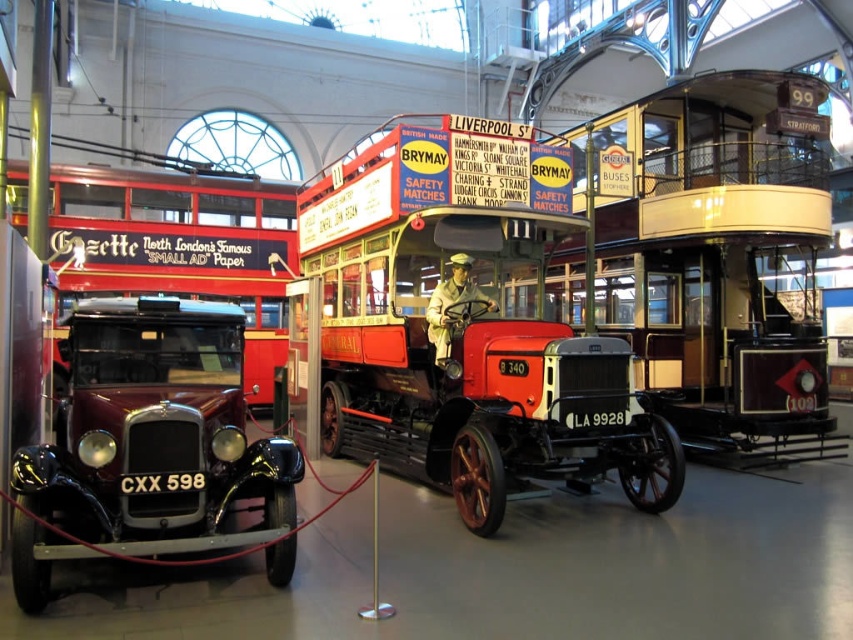
Who is positioned more to the left, matte black bus at center or red polished wood double-decker bus at left?

From the viewer's perspective, red polished wood double-decker bus at left appears more on the left side.

In the scene shown: Which of these two, matte black bus at center or red polished wood double-decker bus at left, stands taller?

Standing taller between the two is red polished wood double-decker bus at left.

The width and height of the screenshot is (853, 640). In order to click on matte black bus at center in this screenshot , I will do `click(712, 259)`.

In order to click on matte black bus at center in this screenshot , I will do `click(712, 259)`.

Can you confirm if red polished wood bus at center is positioned to the right of matte black bus at center?

Incorrect, red polished wood bus at center is not on the right side of matte black bus at center.

Where is `red polished wood bus at center`? The image size is (853, 640). red polished wood bus at center is located at coordinates (467, 321).

Is the position of shiny maroon car at center less distant than that of red polished wood double-decker bus at left?

Yes, it is.

Describe the element at coordinates (155, 433) in the screenshot. This screenshot has height=640, width=853. I see `shiny maroon car at center` at that location.

Is point (115, 396) positioned in front of point (50, 186)?

Yes, point (115, 396) is in front of point (50, 186).

Find the location of a particular element. shiny maroon car at center is located at coordinates (155, 433).